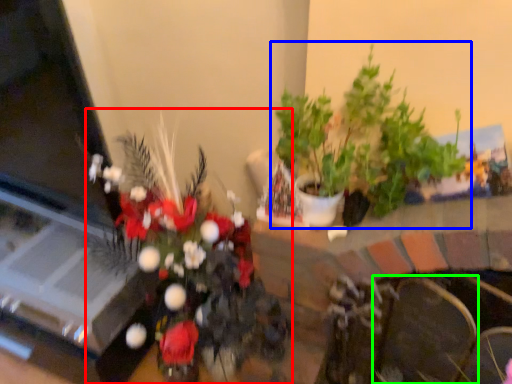
Question: Estimate the real-world distances between objects in this image. Which object is farther from houseplant (highlighted by a red box), houseplant (highlighted by a blue box) or armchair (highlighted by a green box)?

Choices:
 (A) houseplant
 (B) armchair

Answer: (B)